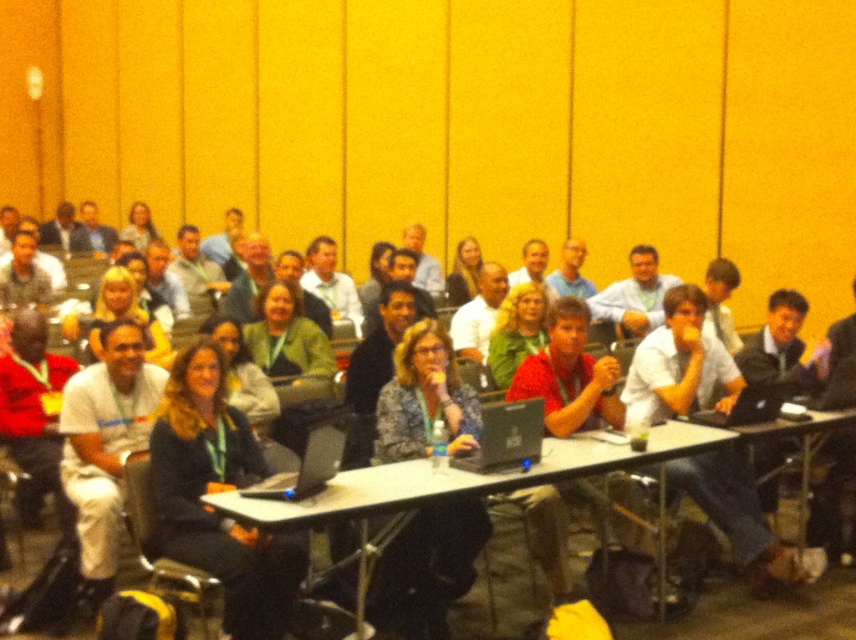
Is white shirt at center closer to the viewer compared to black plastic laptop at center?

No, it is not.

How much distance is there between white shirt at center and black plastic laptop at center?

white shirt at center is 1.14 meters away from black plastic laptop at center.

This screenshot has width=856, height=640. In order to click on white shirt at center in this screenshot , I will do pyautogui.click(x=681, y=365).

Locate an element on the screen. white shirt at center is located at coordinates pyautogui.click(x=681, y=365).

Is point (619, 449) closer to viewer compared to point (485, 452)?

That is False.

Between point (664, 483) and point (512, 433), which one is positioned in front?

Point (512, 433) is more forward.

The width and height of the screenshot is (856, 640). What are the coordinates of `white plastic table at center` in the screenshot? It's located at (520, 476).

Is point (226, 540) closer to camera compared to point (559, 460)?

Yes, it is in front of point (559, 460).

Image resolution: width=856 pixels, height=640 pixels. In order to click on dark blue sweater at center in this screenshot , I will do [210, 506].

What are the coordinates of `dark blue sweater at center` in the screenshot? It's located at (210, 506).